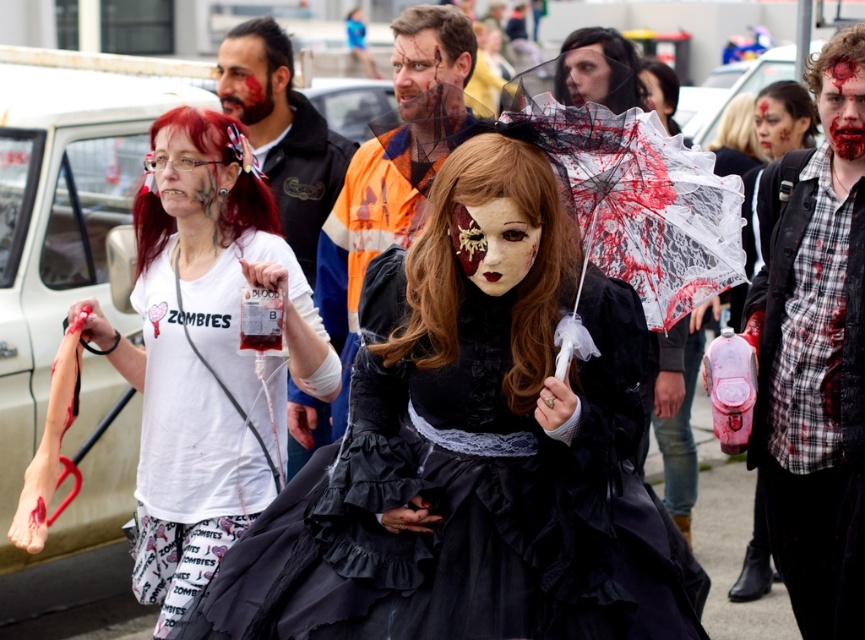
You are a photographer trying to capture a closeup of the zombie woman in the black Victorian dress holding the blood splattered umbrella. You are currently positioned at point A, which is at coordinates point (356,307), and you want to move to point B at coordinates point (761,134) to get a better angle. Will moving from point A to point B bring you closer to the zombie woman?

Point (356,307) is closer to the camera than point (761,134). Moving from point A to point B will take you further away from the zombie woman, so you will be farther from her.

You are a photographer at the zombie event and need to capture a group photo. The camera frame can only accommodate objects up to the width of the matte white face at upper left. Will the black satin dress at center fit within the frame?

The black satin dress at center has a larger width than the matte white face at upper left. Since the camera frame can only accommodate up to the width of the matte white face at upper left, the black satin dress at center will not fit within the frame.

You are a photographer positioned at the camera. You want to take a photo of the black satin dress at center. Is the distance between you and the dress sufficient to capture a clear, detailed image with your standard 50mm lens? Assume your camera can focus clearly up to 5 meters.

The black satin dress at center and the camera are 4.76 meters apart. Since the camera can focus clearly up to 5 meters, the distance is sufficient to capture a clear, detailed image.